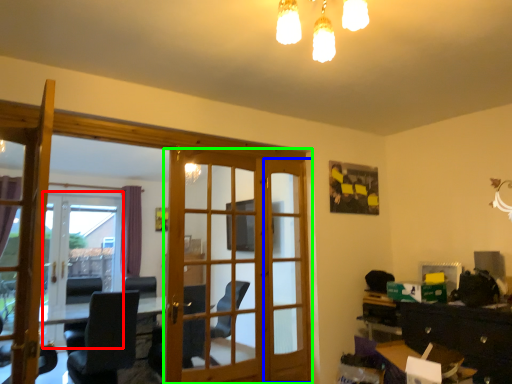
Question: Estimate the real-world distances between objects in this image. Which object is closer to screen door (highlighted by a red box), screen door (highlighted by a blue box) or door (highlighted by a green box)?

Choices:
 (A) screen door
 (B) door

Answer: (A)